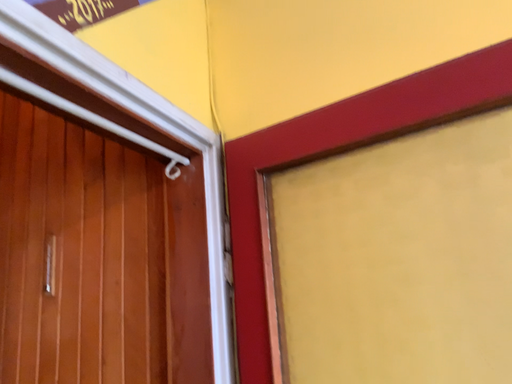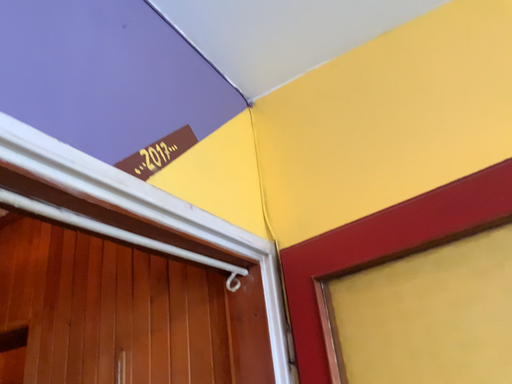
Question: How did the camera likely rotate when shooting the video?

Choices:
 (A) rotated downward
 (B) rotated upward

Answer: (B)